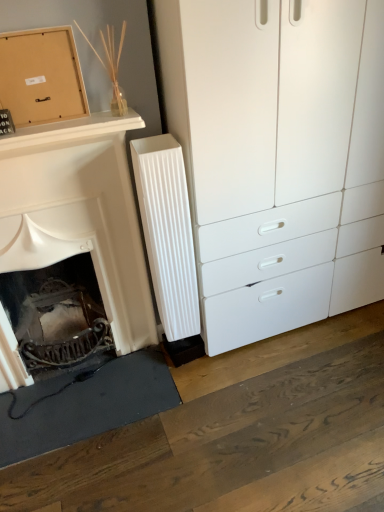
Question: Is white ribbed radiator at center spatially inside matte cardboard box at upper left, or outside of it?

Choices:
 (A) inside
 (B) outside

Answer: (B)

Question: From the image's perspective, is white ribbed radiator at center located above or below matte cardboard box at upper left?

Choices:
 (A) above
 (B) below

Answer: (B)

Question: Estimate the real-world distances between objects in this image. Which object is farther from the matte cardboard box at upper left?

Choices:
 (A) white plastic chest of drawers at right
 (B) white matte fireplace at left
 (C) white ribbed radiator at center

Answer: (A)

Question: Which of these objects is positioned closest to the matte cardboard box at upper left?

Choices:
 (A) white plastic chest of drawers at right
 (B) white ribbed radiator at center
 (C) white matte fireplace at left

Answer: (C)